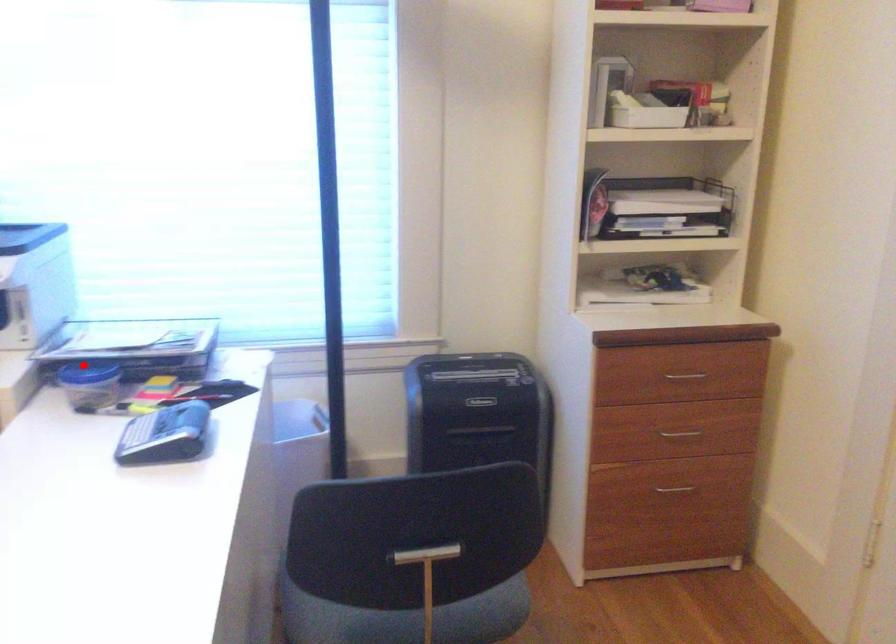
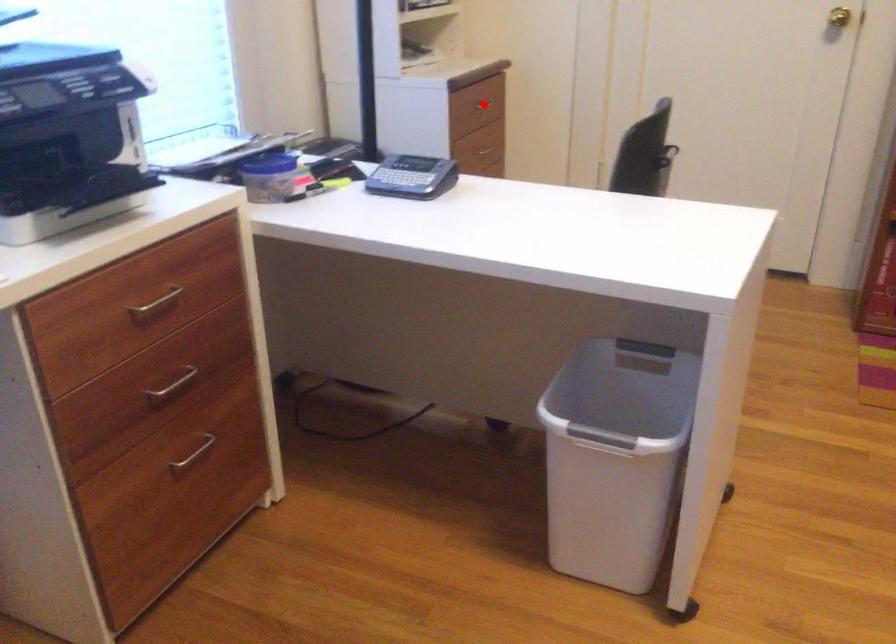
I am providing you with two images of the same scene from different viewpoints. A red point is marked on the first image and another point is marked on the second image. Do the highlighted points in image1 and image2 indicate the same real-world spot?

No